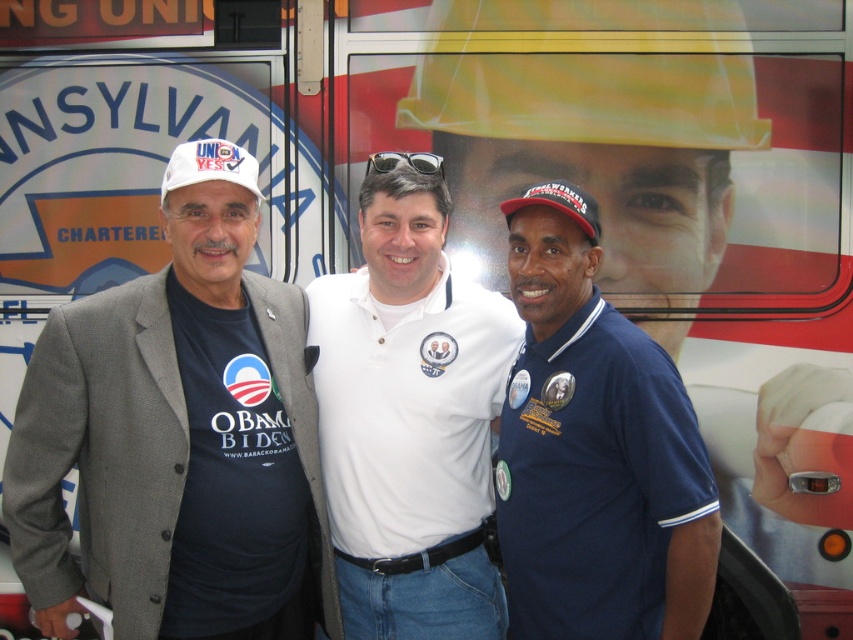
You are a photographer who needs to ensure that both the gray wool blazer at left and the white matte baseball hat at left are clearly visible in your photo. Given that your camera has a minimum focus distance of 20 inches, will you be able to capture both items in focus without moving closer?

The gray wool blazer at left and the white matte baseball hat at left are 22.84 inches apart from each other, which exceeds the camera minimum focus distance of 20 inches. Therefore, the camera can capture both items in focus without moving closer.

You are a photographer at the scene and want to ensure both the white cotton polo shirt at center and the navy blue polo shirt at center are visible in your photo. Which shirt should you focus on to make sure the other is also in frame?

The white cotton polo shirt at center is positioned over the navy blue polo shirt at center. Therefore, focusing on the white cotton polo shirt at center will ensure the navy blue polo shirt at center is also visible since it is beneath it.